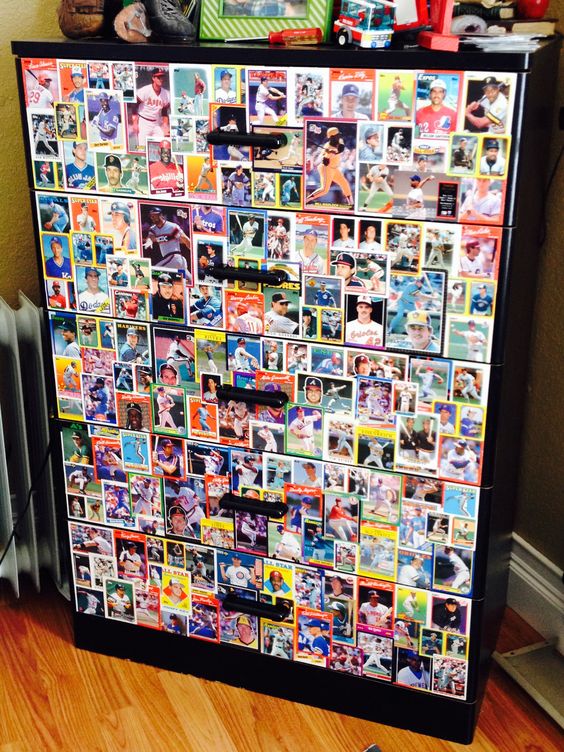
At what (x,y) coordinates should I click in order to perform the action: click on wood floor. Please return your answer as a coordinate pair (x, y). This screenshot has width=564, height=752. Looking at the image, I should click on (148, 720).